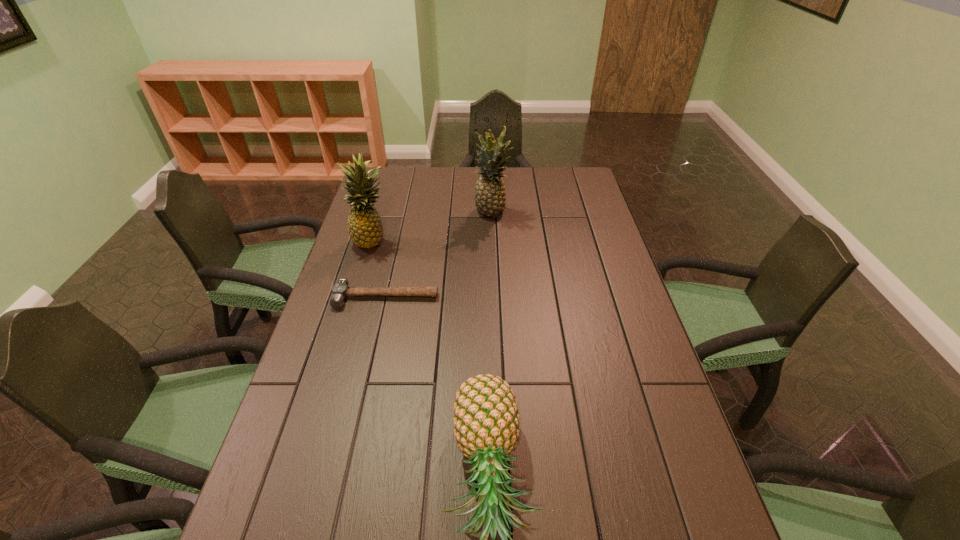
Find the location of a particular element. blank space at the far edge of the desktop is located at coordinates (424, 188).

The width and height of the screenshot is (960, 540). I want to click on free space at the left edge, so click(347, 424).

The image size is (960, 540). In the image, there is a desktop. What are the coordinates of `vacant space at the right edge` in the screenshot? It's located at (681, 436).

In order to click on vacant area at the far right corner in this screenshot , I will do `click(588, 197)`.

This screenshot has height=540, width=960. I want to click on empty space between the farthest object and the third farthest object, so click(x=439, y=255).

Identify the location of free space between the farthest object and the leftmost pineapple. The image size is (960, 540). (433, 227).

At what (x,y) coordinates should I click in order to perform the action: click on free space between the shortest object and the second farthest object. Please return your answer as a coordinate pair (x, y). Looking at the image, I should click on (380, 269).

Locate an element on the screen. The width and height of the screenshot is (960, 540). the second closest object to the third tallest object is located at coordinates (365, 228).

The height and width of the screenshot is (540, 960). I want to click on the closest object to the shortest pineapple, so click(340, 291).

The width and height of the screenshot is (960, 540). Find the location of `pineapple that stands as the closest to the farthest object`. pineapple that stands as the closest to the farthest object is located at coordinates (365, 228).